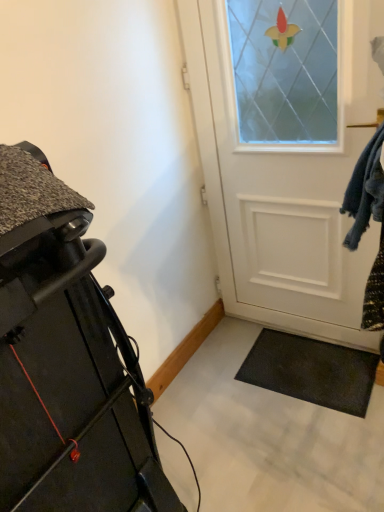
Question: Looking at their shapes, would you say matte black treadmill at left is wider or thinner than white matte door at center?

Choices:
 (A) thin
 (B) wide

Answer: (B)

Question: Is point (59, 330) closer or farther from the camera than point (284, 199)?

Choices:
 (A) closer
 (B) farther

Answer: (A)

Question: In terms of size, does matte black treadmill at left appear bigger or smaller than white matte door at center?

Choices:
 (A) big
 (B) small

Answer: (A)

Question: In terms of size, does white matte door at center appear bigger or smaller than matte black treadmill at left?

Choices:
 (A) small
 (B) big

Answer: (A)

Question: Based on their positions, is white matte door at center located to the left or right of matte black treadmill at left?

Choices:
 (A) left
 (B) right

Answer: (B)

Question: Relative to matte black treadmill at left, is white matte door at center in front or behind?

Choices:
 (A) front
 (B) behind

Answer: (B)

Question: Considering the positions of white matte door at center and matte black treadmill at left in the image, is white matte door at center taller or shorter than matte black treadmill at left?

Choices:
 (A) tall
 (B) short

Answer: (A)